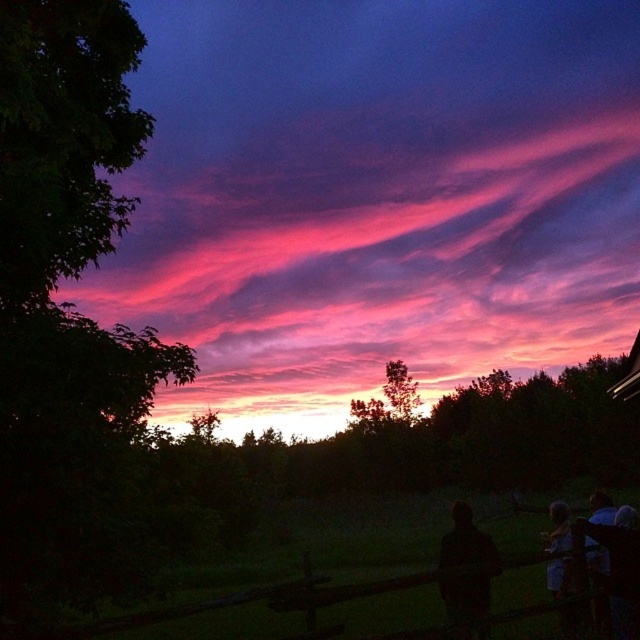
This screenshot has height=640, width=640. In order to click on pink translucent clouds at upper center in this screenshot , I will do `click(376, 243)`.

Can you confirm if pink translucent clouds at upper center is positioned below dark hair at lower right?

Actually, pink translucent clouds at upper center is above dark hair at lower right.

Find the location of a particular element. The height and width of the screenshot is (640, 640). pink translucent clouds at upper center is located at coordinates (376, 243).

Does black matte person at lower right have a lesser height compared to dark hair at lower right?

Incorrect, black matte person at lower right's height does not fall short of dark hair at lower right's.

Looking at this image, is black matte person at lower right positioned in front of dark hair at lower right?

Yes, it is.

Which is behind, point (449, 593) or point (625, 554)?

Point (449, 593)

In order to click on black matte person at lower right in this screenshot , I will do `click(467, 602)`.

Does pink translucent clouds at upper center come in front of black matte person at lower right?

No, it is not.

Is pink translucent clouds at upper center below black matte person at lower right?

No, pink translucent clouds at upper center is not below black matte person at lower right.

Between point (547, 124) and point (481, 534), which one is positioned in front?

Point (481, 534)

I want to click on pink translucent clouds at upper center, so click(376, 243).